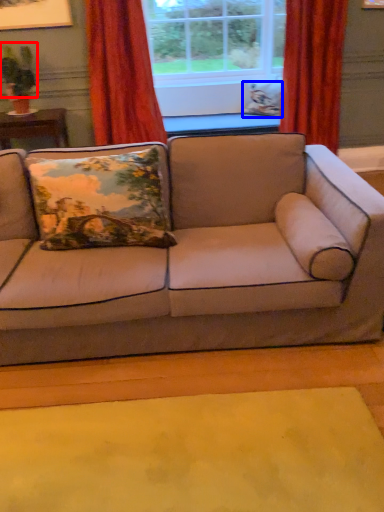
Question: Which object appears farthest to the camera in this image, plant (highlighted by a red box) or pillow (highlighted by a blue box)?

Choices:
 (A) plant
 (B) pillow

Answer: (B)